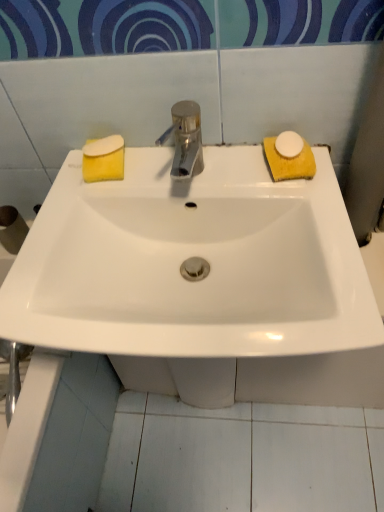
Question: Would you say white matte soap at right, the 1th soap from the right, is outside polished metallic tap at center?

Choices:
 (A) no
 (B) yes

Answer: (B)

Question: Considering the relative sizes of white matte soap at right, arranged as the third soap when viewed from the left, and polished metallic tap at center in the image provided, is white matte soap at right, arranged as the third soap when viewed from the left, taller than polished metallic tap at center?

Choices:
 (A) no
 (B) yes

Answer: (A)

Question: Considering the relative sizes of white matte soap at right, arranged as the third soap when viewed from the left, and polished metallic tap at center in the image provided, is white matte soap at right, arranged as the third soap when viewed from the left, smaller than polished metallic tap at center?

Choices:
 (A) no
 (B) yes

Answer: (B)

Question: From the image's perspective, is white matte soap at right, the 1th soap from the right, on top of polished metallic tap at center?

Choices:
 (A) no
 (B) yes

Answer: (B)

Question: From a real-world perspective, is white matte soap at right, arranged as the third soap when viewed from the left, over polished metallic tap at center?

Choices:
 (A) no
 (B) yes

Answer: (A)

Question: Does white matte soap at right, the 1th soap from the right, turn towards polished metallic tap at center?

Choices:
 (A) yes
 (B) no

Answer: (B)

Question: Is the surface of yellow sponge at left, the 1th soap in the left-to-right sequence, in direct contact with white matte soap at right, the 1th soap from the right?

Choices:
 (A) yes
 (B) no

Answer: (B)

Question: From the image's perspective, is yellow sponge at left, the 3th soap in the right-to-left sequence, under white matte soap at right, arranged as the third soap when viewed from the left?

Choices:
 (A) no
 (B) yes

Answer: (A)

Question: From a real-world perspective, is yellow sponge at left, the 1th soap in the left-to-right sequence, physically above white matte soap at right, the 1th soap from the right?

Choices:
 (A) no
 (B) yes

Answer: (B)

Question: Considering the relative sizes of yellow sponge at left, the 1th soap in the left-to-right sequence, and white matte soap at right, arranged as the third soap when viewed from the left, in the image provided, is yellow sponge at left, the 1th soap in the left-to-right sequence, thinner than white matte soap at right, arranged as the third soap when viewed from the left,?

Choices:
 (A) yes
 (B) no

Answer: (A)

Question: Is yellow sponge at left, the 3th soap in the right-to-left sequence, positioned beyond the bounds of white matte soap at right, arranged as the third soap when viewed from the left?

Choices:
 (A) no
 (B) yes

Answer: (B)

Question: Is yellow sponge at left, the 3th soap in the right-to-left sequence, taller than white matte soap at right, arranged as the third soap when viewed from the left?

Choices:
 (A) no
 (B) yes

Answer: (A)

Question: Can you confirm if white matte soap at right, arranged as the third soap when viewed from the left, is thinner than white glossy sink at center?

Choices:
 (A) yes
 (B) no

Answer: (A)